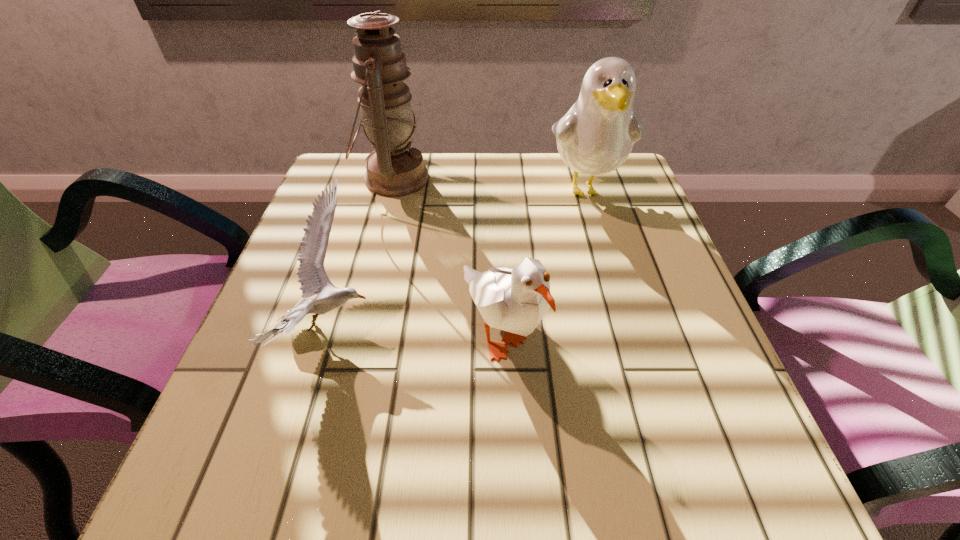
Where is `empty space that is in between the third tallest object and the farthest gull`? empty space that is in between the third tallest object and the farthest gull is located at coordinates (543, 260).

The image size is (960, 540). What are the coordinates of `unoccupied area between the tallest gull and the oil lamp` in the screenshot? It's located at (490, 184).

Locate an element on the screen. The width and height of the screenshot is (960, 540). vacant area that lies between the tallest gull and the shortest gull is located at coordinates pyautogui.click(x=458, y=258).

Locate an element on the screen. Image resolution: width=960 pixels, height=540 pixels. vacant space in between the rightmost gull and the shortest object is located at coordinates (458, 258).

Identify which object is the nearest to the third tallest object. Please provide its 2D coordinates. Your answer should be formatted as a tuple, i.e. [(x, y)], where the tuple contains the x and y coordinates of a point satisfying the conditions above.

[(312, 277)]

The height and width of the screenshot is (540, 960). I want to click on object identified as the second closest to the third shortest object, so click(x=394, y=169).

Identify the location of gull that is the second closest to the second tallest gull. (595, 137).

Locate which gull is the closest to the tallest object. Please provide its 2D coordinates. Your answer should be formatted as a tuple, i.e. [(x, y)], where the tuple contains the x and y coordinates of a point satisfying the conditions above.

[(312, 277)]

Find the location of `free point that satisfies the following two spatial constraints: 1. on the beak of the third shortest object; 2. at the tip of the beak of the shortest gull`. free point that satisfies the following two spatial constraints: 1. on the beak of the third shortest object; 2. at the tip of the beak of the shortest gull is located at coordinates (626, 327).